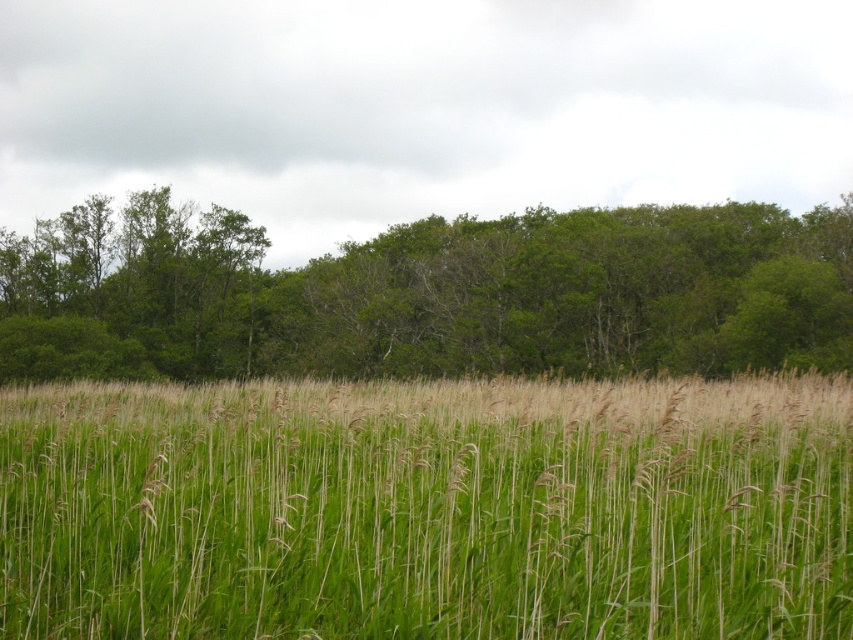
Question: Considering the relative positions of green grass at center and green leafy trees at upper center in the image provided, where is green grass at center located with respect to green leafy trees at upper center?

Choices:
 (A) right
 (B) left

Answer: (A)

Question: Can you confirm if green grass at center is smaller than green leafy trees at upper center?

Choices:
 (A) yes
 (B) no

Answer: (A)

Question: Which of the following is the closest to the observer?

Choices:
 (A) (224, 365)
 (B) (316, 464)

Answer: (B)

Question: Can you confirm if green grass at center is thinner than green leafy trees at upper center?

Choices:
 (A) no
 (B) yes

Answer: (B)

Question: Which point is closer to the camera taking this photo?

Choices:
 (A) (619, 618)
 (B) (770, 246)

Answer: (A)